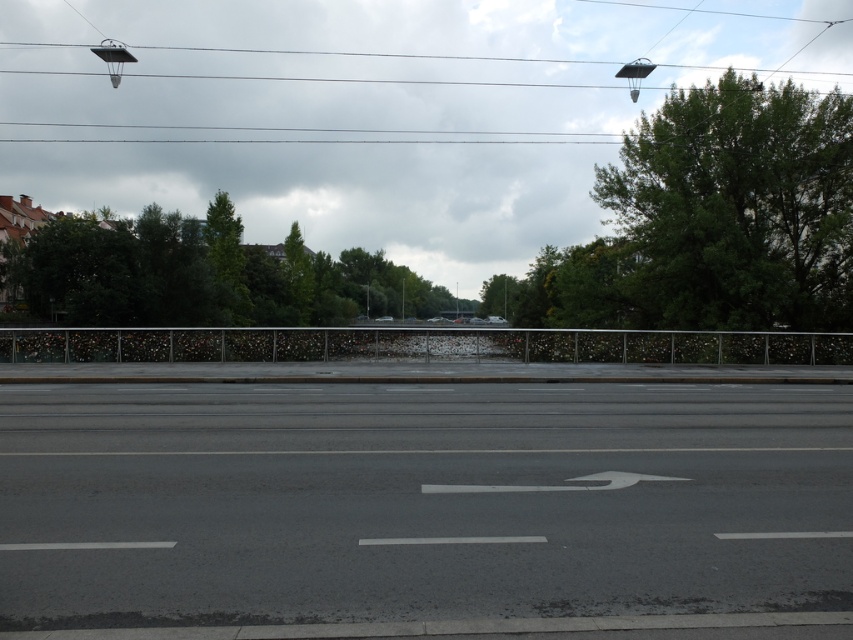
Who is shorter, green leafy tree at upper right or green leafy tree at upper center?

green leafy tree at upper center

Locate an element on the screen. green leafy tree at upper right is located at coordinates (735, 209).

Identify the location of green leafy tree at upper right. (735, 209).

Identify the location of metallic wire at upper center. (404, 61).

What do you see at coordinates (404, 61) in the screenshot? The width and height of the screenshot is (853, 640). I see `metallic wire at upper center` at bounding box center [404, 61].

Locate an element on the screen. Image resolution: width=853 pixels, height=640 pixels. metallic wire at upper center is located at coordinates (404, 61).

Does metallic wire at upper center have a lesser height compared to green leafy tree at upper right?

Yes.

Is point (585, 74) closer to viewer compared to point (718, 296)?

No.

Locate an element on the screen. metallic wire at upper center is located at coordinates (404, 61).